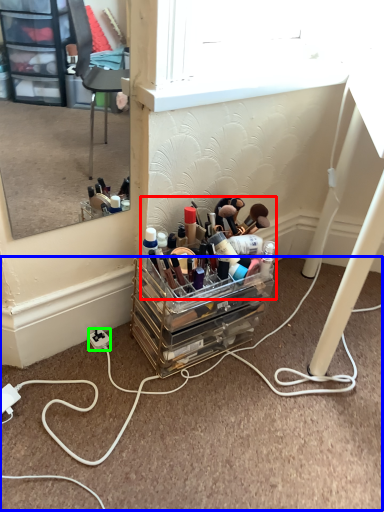
Question: Considering the real-world distances, which object is closest to toiletry (highlighted by a red box)? cable (highlighted by a blue box) or power outlet (highlighted by a green box).

Choices:
 (A) cable
 (B) power outlet

Answer: (A)